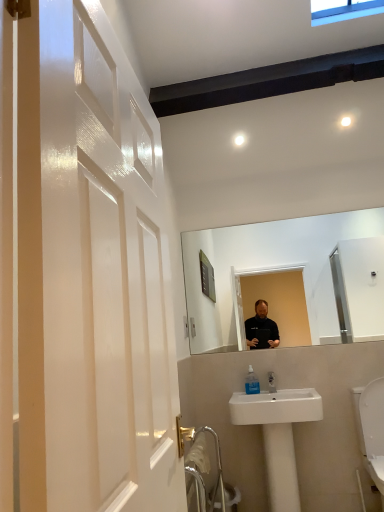
Question: Can you confirm if white ceramic sink at lower center is smaller than clear plastic soap dispenser at lower center?

Choices:
 (A) no
 (B) yes

Answer: (A)

Question: Is white ceramic sink at lower center not near clear plastic soap dispenser at lower center?

Choices:
 (A) no
 (B) yes

Answer: (A)

Question: From the image's perspective, would you say white ceramic sink at lower center is shown under clear plastic soap dispenser at lower center?

Choices:
 (A) yes
 (B) no

Answer: (A)

Question: Is clear plastic soap dispenser at lower center completely or partially inside white ceramic sink at lower center?

Choices:
 (A) yes
 (B) no

Answer: (A)

Question: Does white ceramic sink at lower center lie behind clear plastic soap dispenser at lower center?

Choices:
 (A) no
 (B) yes

Answer: (A)

Question: Is white ceramic sink at lower center at the right side of clear plastic soap dispenser at lower center?

Choices:
 (A) no
 (B) yes

Answer: (B)

Question: Is clear plastic soap dispenser at lower center oriented away from white ceramic sink at lower center?

Choices:
 (A) no
 (B) yes

Answer: (B)

Question: Could you tell me if clear plastic soap dispenser at lower center is turned towards white ceramic sink at lower center?

Choices:
 (A) yes
 (B) no

Answer: (A)

Question: Is clear plastic soap dispenser at lower center positioned far away from white ceramic sink at lower center?

Choices:
 (A) no
 (B) yes

Answer: (A)

Question: Can you confirm if clear plastic soap dispenser at lower center is shorter than white ceramic sink at lower center?

Choices:
 (A) no
 (B) yes

Answer: (B)

Question: Does clear plastic soap dispenser at lower center appear on the left side of white ceramic sink at lower center?

Choices:
 (A) no
 (B) yes

Answer: (B)

Question: Considering the relative positions of clear plastic soap dispenser at lower center and white ceramic sink at lower center in the image provided, is clear plastic soap dispenser at lower center to the right of white ceramic sink at lower center from the viewer's perspective?

Choices:
 (A) no
 (B) yes

Answer: (A)

Question: From the image's perspective, relative to white ceramic sink at lower center, is clear plastic soap dispenser at lower center above or below?

Choices:
 (A) below
 (B) above

Answer: (B)